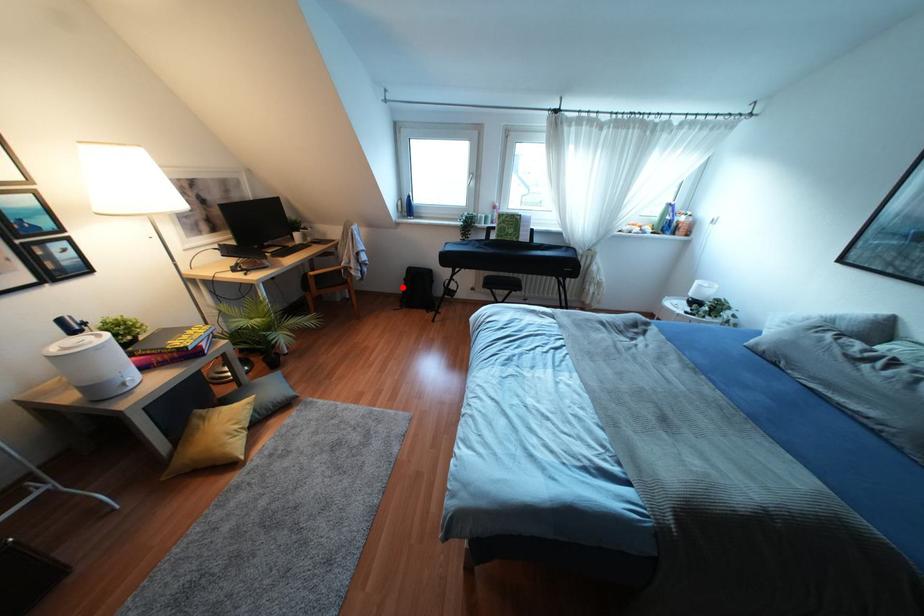
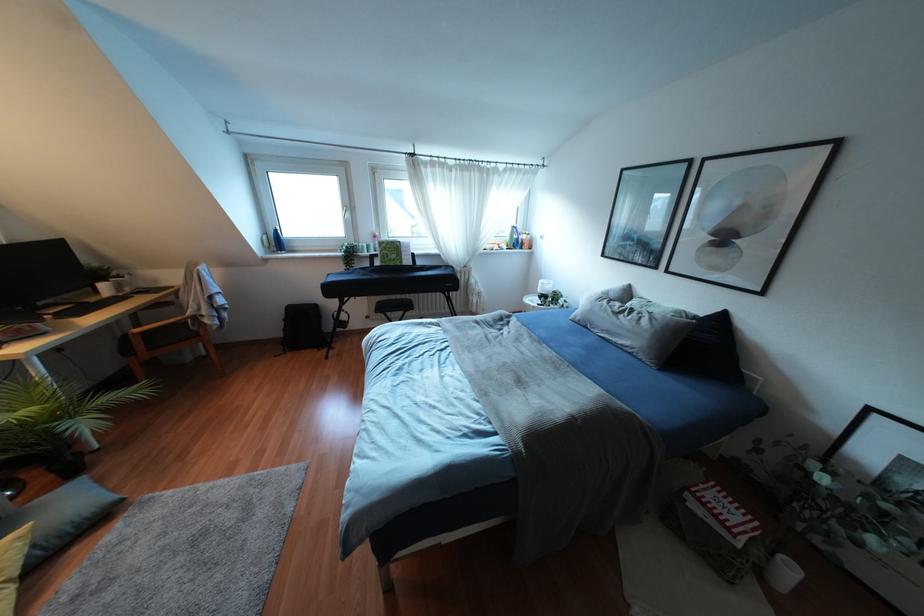
Question: I am providing you with two images of the same scene from different viewpoints. In image1, a red point is highlighted. Considering the same 3D point in image2, which of the following is correct?

Choices:
 (A) It is closer
 (B) It is farther

Answer: (B)